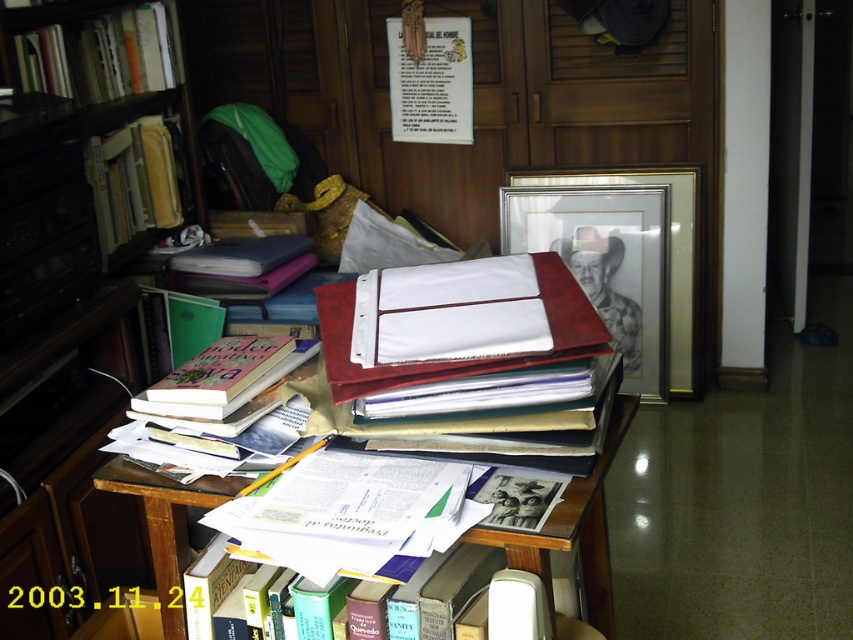
Who is more distant from viewer, (0, 323) or (242, 454)?

Positioned behind is point (0, 323).

Does wooden bookshelf at left have a lesser width compared to matte pink book at center?

No.

The height and width of the screenshot is (640, 853). What are the coordinates of `wooden bookshelf at left` in the screenshot? It's located at (67, 349).

Is wooden bookshelf at left closer to camera compared to hardcover book at left?

Yes, it is.

Which is in front, point (33, 292) or point (97, 154)?

Point (33, 292) is in front.

Measure the distance between point (119, 333) and camera.

They are 6.30 feet apart.

Where is `wooden bookshelf at left`? The height and width of the screenshot is (640, 853). wooden bookshelf at left is located at coordinates (67, 349).

Can you confirm if wooden desk at center is smaller than hardcover book at upper left?

Yes, wooden desk at center is smaller than hardcover book at upper left.

Does wooden desk at center appear on the right side of hardcover book at upper left?

Indeed, wooden desk at center is positioned on the right side of hardcover book at upper left.

Locate an element on the screen. The width and height of the screenshot is (853, 640). wooden desk at center is located at coordinates (575, 529).

Where is `wooden desk at center`? Image resolution: width=853 pixels, height=640 pixels. wooden desk at center is located at coordinates (575, 529).